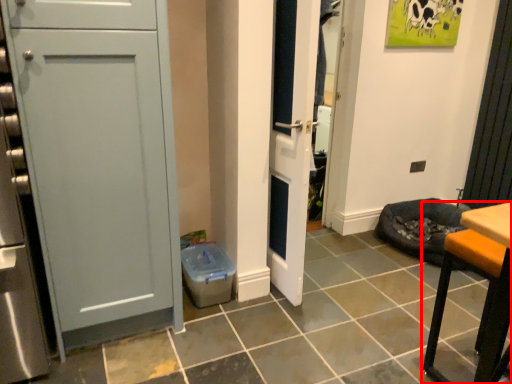
Question: Where is furniture (annotated by the red box) located in relation to door in the image?

Choices:
 (A) left
 (B) right

Answer: (B)